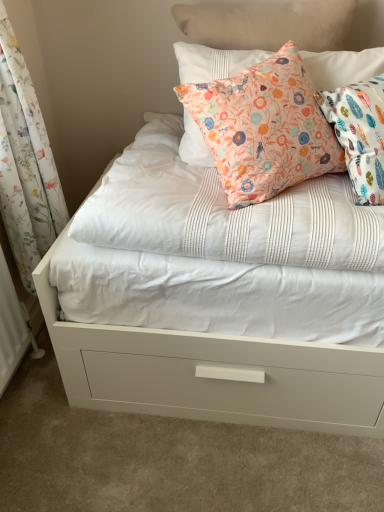
At what (x,y) coordinates should I click in order to perform the action: click on floral fabric curtain at left. Please return your answer as a coordinate pair (x, y). The image size is (384, 512). Looking at the image, I should click on (25, 163).

Measure the distance between point (56, 180) and camera.

Point (56, 180) and camera are 1.54 meters apart.

What do you see at coordinates (25, 163) in the screenshot?
I see `floral fabric curtain at left` at bounding box center [25, 163].

This screenshot has height=512, width=384. What do you see at coordinates (264, 128) in the screenshot?
I see `floral fabric pillow at upper center` at bounding box center [264, 128].

Identify the location of floral fabric pillow at upper center. This screenshot has width=384, height=512. point(264,128).

This screenshot has width=384, height=512. In order to click on floral fabric curtain at left in this screenshot , I will do `click(25, 163)`.

Between floral fabric pillow at upper center and floral fabric curtain at left, which one appears on the left side from the viewer's perspective?

floral fabric curtain at left.

Consider the image. Is floral fabric pillow at upper center behind floral fabric curtain at left?

Yes, the depth of floral fabric pillow at upper center is greater than that of floral fabric curtain at left.

Is point (273, 133) positioned before point (43, 195)?

Yes, it is.

From the image's perspective, is floral fabric pillow at upper center located above or below floral fabric curtain at left?

Clearly, from the image's perspective, floral fabric pillow at upper center is above floral fabric curtain at left.

From a real-world perspective, between floral fabric pillow at upper center and floral fabric curtain at left, who is vertically lower?

In real-world perspective, floral fabric curtain at left is lower.

Which of these two, floral fabric pillow at upper center or floral fabric curtain at left, is wider?

With larger width is floral fabric pillow at upper center.

Between floral fabric pillow at upper center and floral fabric curtain at left, which one has less height?

Standing shorter between the two is floral fabric pillow at upper center.

In terms of size, does floral fabric pillow at upper center appear bigger or smaller than floral fabric curtain at left?

In the image, floral fabric pillow at upper center appears to be smaller than floral fabric curtain at left.

Is floral fabric pillow at upper center situated inside floral fabric curtain at left or outside?

floral fabric pillow at upper center is located beyond the bounds of floral fabric curtain at left.

Is floral fabric pillow at upper center beside floral fabric curtain at left?

No.

Is floral fabric pillow at upper center oriented towards floral fabric curtain at left?

No, floral fabric pillow at upper center is not facing towards floral fabric curtain at left.

What's the angular difference between floral fabric pillow at upper center and floral fabric curtain at left's facing directions?

90.8 degrees separate the facing orientations of floral fabric pillow at upper center and floral fabric curtain at left.

Locate an element on the screen. The width and height of the screenshot is (384, 512). pillow that appears above the floral fabric curtain at left (from a real-world perspective) is located at coordinates (264, 128).

Which object is positioned more to the right, floral fabric curtain at left or floral fabric pillow at upper center?

Positioned to the right is floral fabric pillow at upper center.

Which object is more forward, floral fabric curtain at left or floral fabric pillow at upper center?

floral fabric curtain at left is closer to the camera.

Does point (14, 162) come behind point (340, 163)?

That is True.

From the image's perspective, which object appears higher, floral fabric curtain at left or floral fabric pillow at upper center?

floral fabric pillow at upper center is shown above in the image.

From a real-world perspective, who is located higher, floral fabric curtain at left or floral fabric pillow at upper center?

floral fabric pillow at upper center is physically above.

Between floral fabric curtain at left and floral fabric pillow at upper center, which one has larger width?

With larger width is floral fabric pillow at upper center.

Between floral fabric curtain at left and floral fabric pillow at upper center, which one has less height?

floral fabric pillow at upper center.

Does floral fabric curtain at left have a larger size compared to floral fabric pillow at upper center?

Yes.

Would you say floral fabric curtain at left is inside or outside floral fabric pillow at upper center?

floral fabric curtain at left lies outside floral fabric pillow at upper center.

Is floral fabric curtain at left positioned far away from floral fabric pillow at upper center?

No.

Is floral fabric curtain at left facing away from floral fabric pillow at upper center?

No, floral fabric curtain at left is not facing the opposite direction of floral fabric pillow at upper center.

What's the angular difference between floral fabric curtain at left and floral fabric pillow at upper center's facing directions?

90.8 degrees separate the facing orientations of floral fabric curtain at left and floral fabric pillow at upper center.

How far apart are floral fabric curtain at left and floral fabric pillow at upper center?

floral fabric curtain at left is 25.82 inches away from floral fabric pillow at upper center.

The image size is (384, 512). Identify the location of pillow above the floral fabric curtain at left (from a real-world perspective). (264, 128).

In order to click on curtain lying on the left of floral fabric pillow at upper center in this screenshot , I will do [25, 163].

You are a GUI agent. You are given a task and a screenshot of the screen. Output one action in this format:
    pyautogui.click(x=<x>, y=<y>)
    Task: Click on the curtain that is in front of the floral fabric pillow at upper center
    This screenshot has height=512, width=384.
    Given the screenshot: What is the action you would take?
    [x=25, y=163]